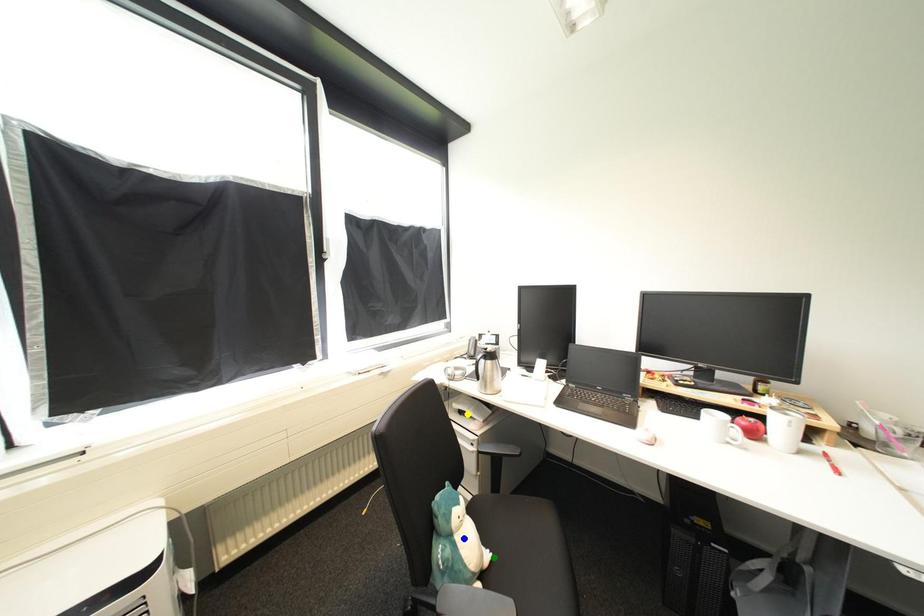
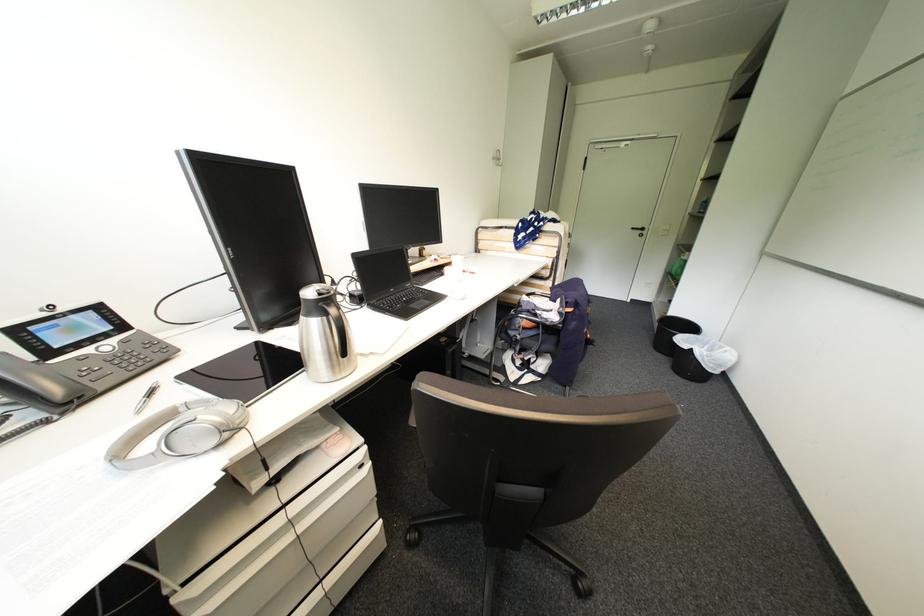
I am providing you with two images of the same scene from different viewpoints. Three points are marked in image1. Which point corresponds to a part or object that is occluded in image2?In image1, three points are marked. Which of them correspond to a part or object that is occluded in image2?Among the three points shown in image1, which one corresponds to a part or object that is no longer visible due to occlusion in image2?

green point, blue point